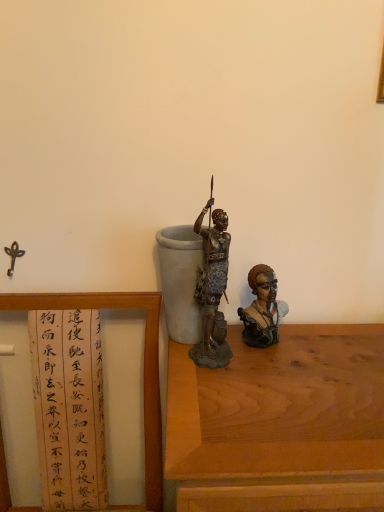
Locate an element on the screen. The width and height of the screenshot is (384, 512). free space on the front side of matte brown bust at right, which is counted as the 1th person, starting from the right is located at coordinates pyautogui.click(x=281, y=385).